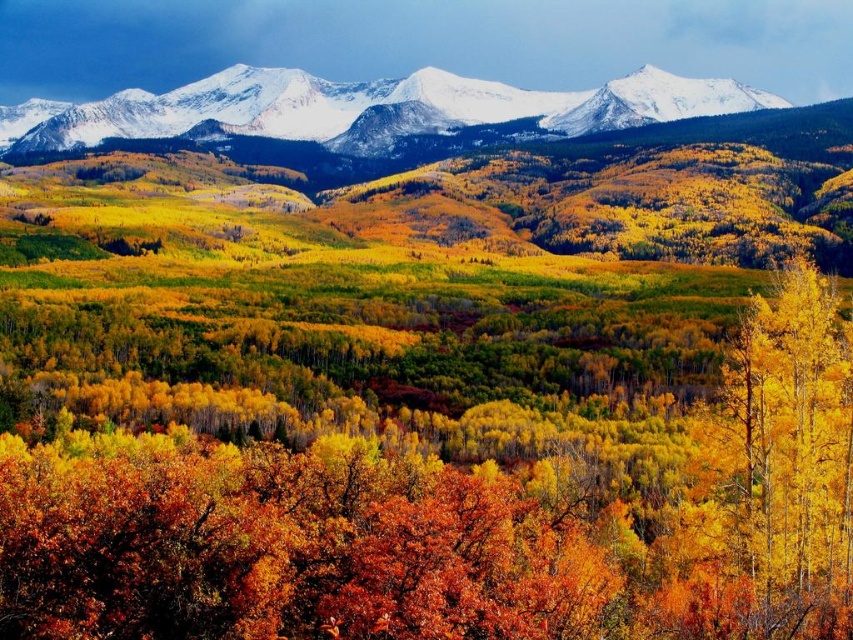
You are standing at the center of the image and want to find the yellow smooth tree at right. In which direction should you look to locate it?

The yellow smooth tree at right is located at point (773, 477), which is to the right side of the image. You should look to your right to find it.

You are a hiker standing at the base of the yellow smooth tree at right and want to reach the snowy white mountains at upper center. Which object is taller, and how might this affect your visibility?

The yellow smooth tree at right is taller than the snowy white mountains at upper center. This means the tree might block your view of the mountains, so you may need to move to a higher vantage point to see them clearly.

You are an artist planning to paint this autumn landscape. You want to emphasize the yellow smooth tree at right and the snowy white mountains at upper center. Which object should you paint first if you want to follow the principle of painting larger objects before smaller ones?

The yellow smooth tree at right should be painted first because it has a larger size compared to the snowy white mountains at upper center.